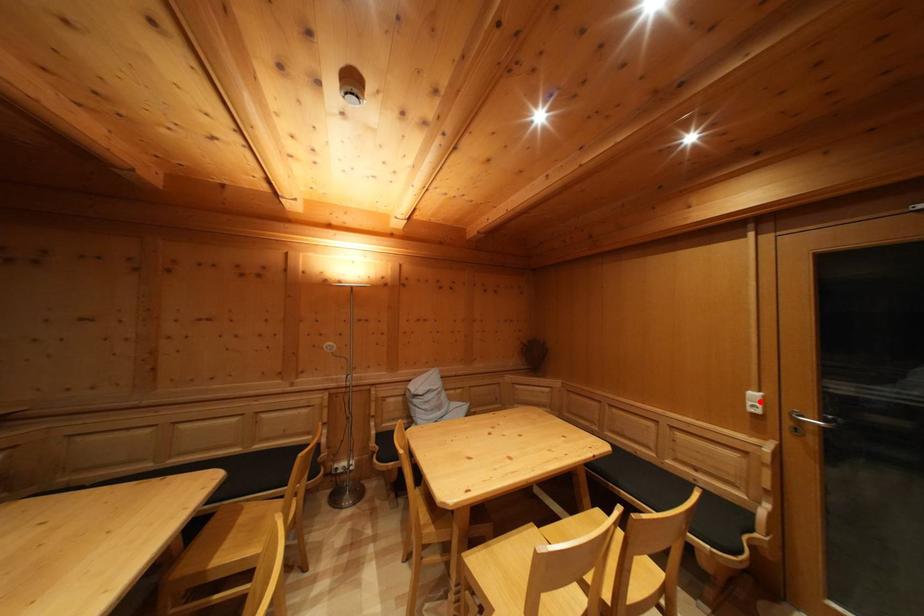
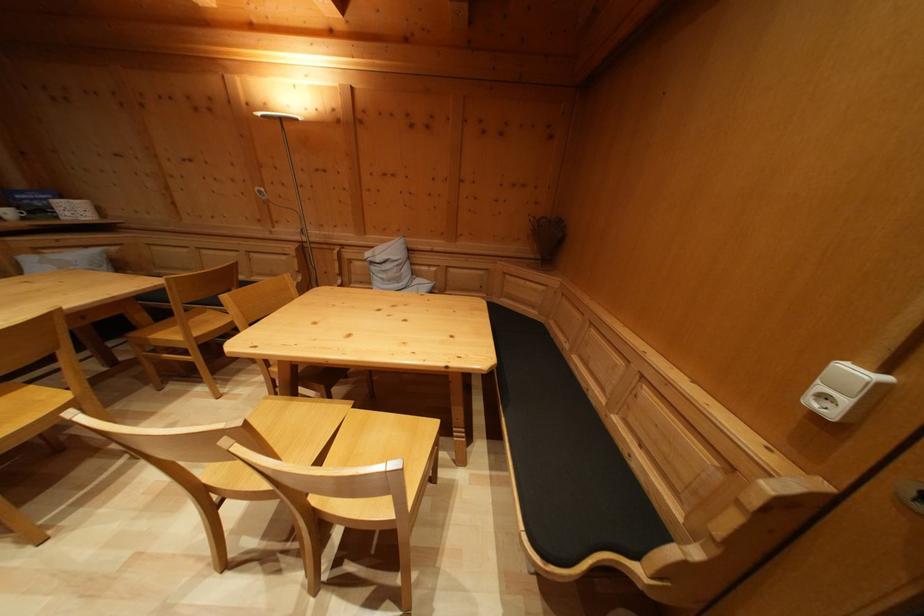
In the second image, find the point that corresponds to the highlighted location in the first image.

(859, 379)